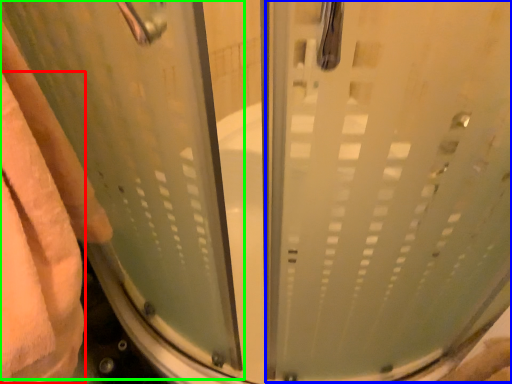
Question: Based on their relative distances, which object is nearer to bath towel (highlighted by a red box)? Choose from screen door (highlighted by a blue box) and screen door (highlighted by a green box).

Choices:
 (A) screen door
 (B) screen door

Answer: (B)